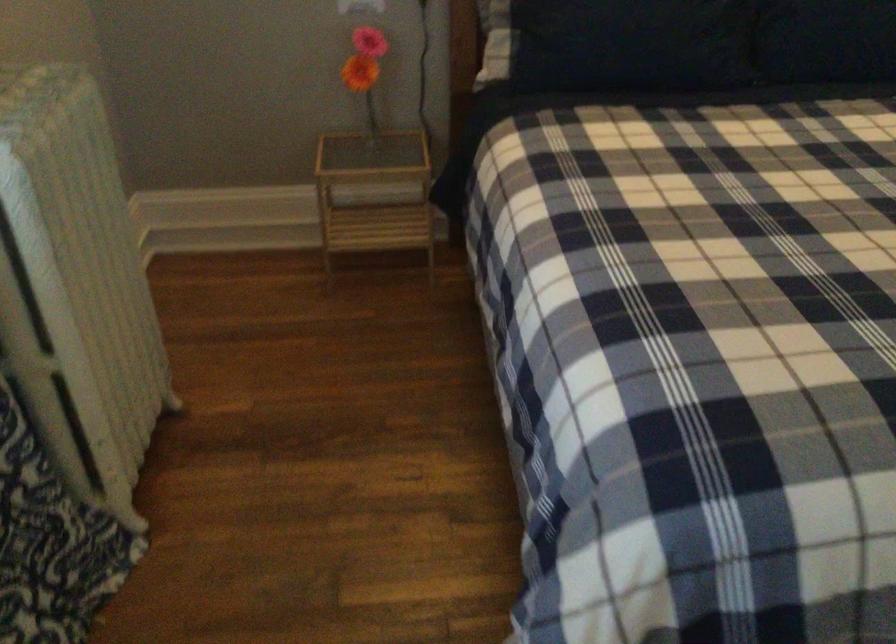
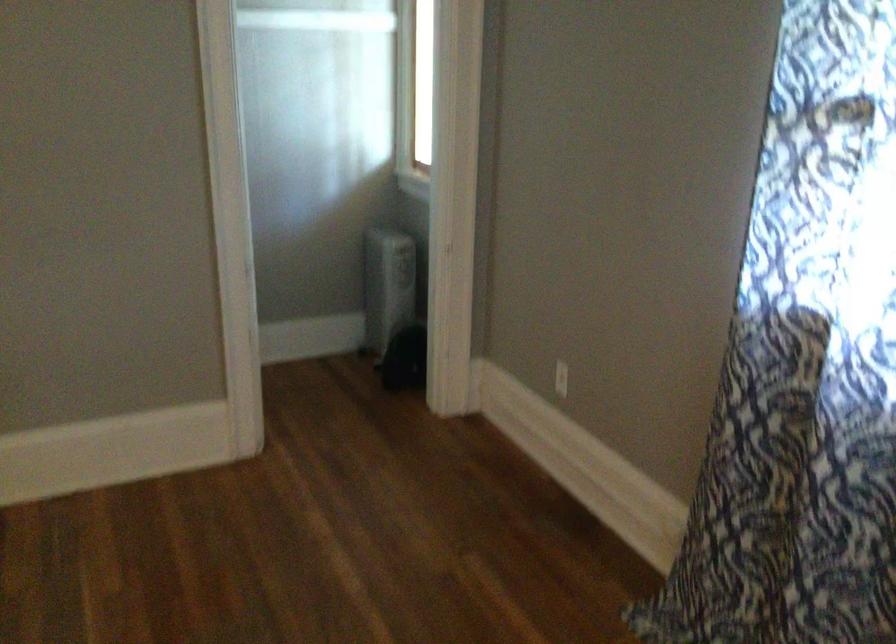
First-person continuous shooting, in which direction is the camera rotating?

The rotation direction of the camera is right-down.